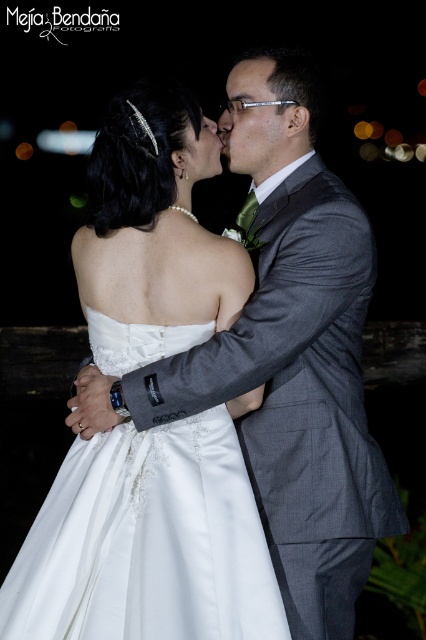
Question: Is gray textured suit at center to the left of matte black forehead at center from the viewer's perspective?

Choices:
 (A) no
 (B) yes

Answer: (A)

Question: Does white satin dress at center appear on the left side of matte black forehead at center?

Choices:
 (A) yes
 (B) no

Answer: (A)

Question: Estimate the real-world distances between objects in this image. Which object is farther from the matte black forehead at center?

Choices:
 (A) white satin dress at center
 (B) gray textured suit at center

Answer: (A)

Question: Which point is closer to the camera?

Choices:
 (A) white satin dress at center
 (B) matte black forehead at center
 (C) gray textured suit at center

Answer: (A)

Question: Is white satin dress at center positioned in front of matte black forehead at center?

Choices:
 (A) no
 (B) yes

Answer: (B)

Question: Which of the following is the closest to the observer?

Choices:
 (A) matte black forehead at center
 (B) white satin dress at center

Answer: (B)